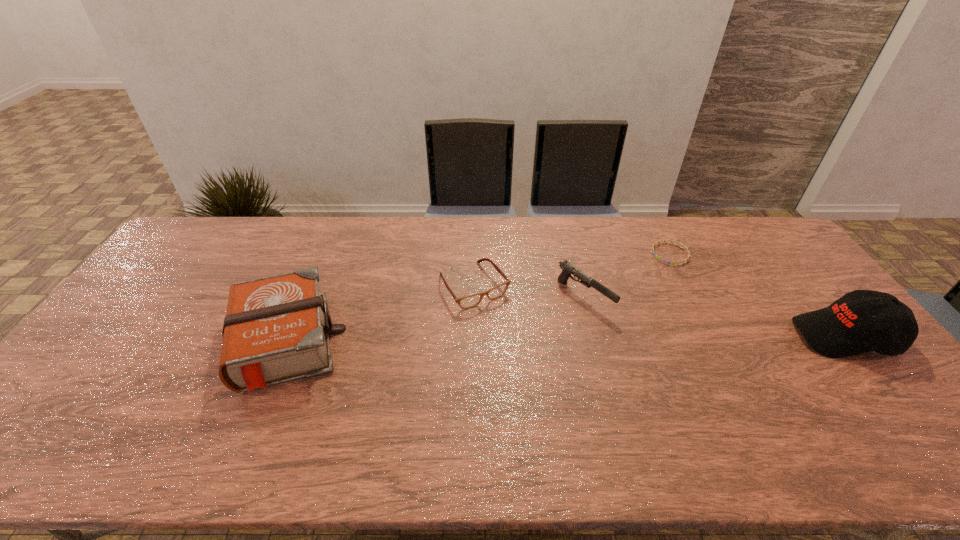
Locate an element on the screen. The height and width of the screenshot is (540, 960). Bible is located at coordinates (276, 329).

Identify the location of baseball cap. (861, 321).

Image resolution: width=960 pixels, height=540 pixels. In order to click on the fourth object from right to left in this screenshot , I will do `click(465, 302)`.

Where is `spectacles`? The width and height of the screenshot is (960, 540). spectacles is located at coordinates (x=465, y=302).

Identify the location of gun. (567, 269).

At what (x,y) coordinates should I click in order to perform the action: click on the third tallest object. Please return your answer as a coordinate pair (x, y). The image size is (960, 540). Looking at the image, I should click on (567, 269).

The height and width of the screenshot is (540, 960). Identify the location of the fourth object from left to right. pos(652,248).

Identify the location of bracelet. (652, 248).

Where is `free space located on the back of the Bible`? The height and width of the screenshot is (540, 960). free space located on the back of the Bible is located at coordinates (318, 262).

Find the location of a particular element. vacant space located on the front-facing side of the baseball cap is located at coordinates (763, 336).